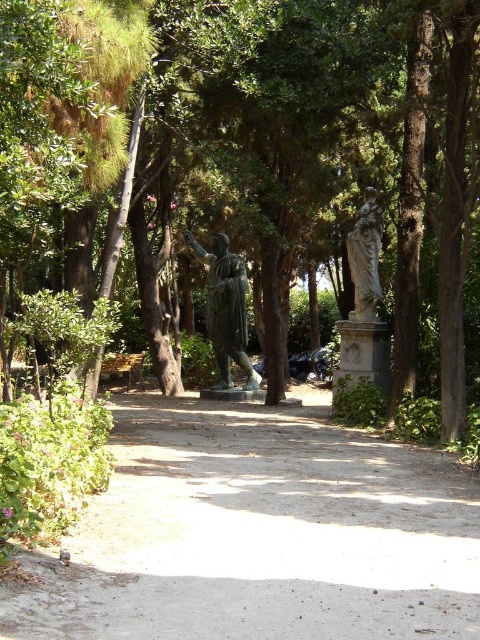
Question: Which point is closer to the camera?

Choices:
 (A) dirt path at center
 (B) bronze statue at center
 (C) wooden bench at lower left
 (D) stone statue at center

Answer: (A)

Question: Is dirt path at center wider than stone statue at center?

Choices:
 (A) yes
 (B) no

Answer: (A)

Question: Which point is closer to the camera?

Choices:
 (A) (116, 365)
 (B) (328, 157)

Answer: (B)

Question: Is green leafy tree at center thinner than bronze statue at center?

Choices:
 (A) no
 (B) yes

Answer: (A)

Question: Is green leafy tree at center positioned before bronze statue at center?

Choices:
 (A) yes
 (B) no

Answer: (A)

Question: Among these objects, which one is nearest to the camera?

Choices:
 (A) green leafy tree at center
 (B) dirt path at center
 (C) wooden bench at lower left

Answer: (B)